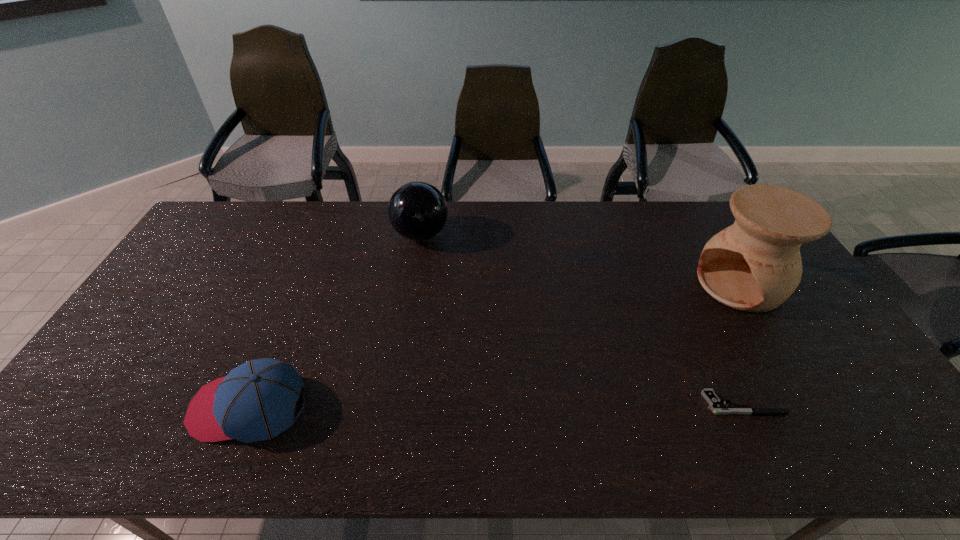
Locate an element on the screen. baseball cap is located at coordinates click(x=256, y=401).

Where is `the leftmost object`? The width and height of the screenshot is (960, 540). the leftmost object is located at coordinates (256, 401).

The image size is (960, 540). I want to click on pistol, so click(x=715, y=404).

Find the location of a particular element. pottery is located at coordinates (754, 265).

This screenshot has width=960, height=540. Find the location of `the second farthest object`. the second farthest object is located at coordinates (754, 265).

Where is `bowling ball`? This screenshot has height=540, width=960. bowling ball is located at coordinates (417, 210).

What are the coordinates of `the third object from right to left` in the screenshot? It's located at (417, 210).

The width and height of the screenshot is (960, 540). I want to click on vacant space situated 0.150m on the front-facing side of the third tallest object, so click(132, 407).

The height and width of the screenshot is (540, 960). I want to click on vacant space situated on the front-facing side of the third tallest object, so click(x=70, y=407).

Where is `free space located 0.210m on the front-facing side of the third tallest object`? The width and height of the screenshot is (960, 540). free space located 0.210m on the front-facing side of the third tallest object is located at coordinates (107, 407).